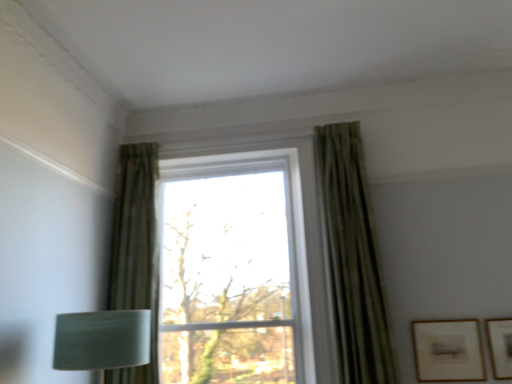
Image resolution: width=512 pixels, height=384 pixels. Identify the location of green textured curtain at upper right, which is the 1th curtain from right to left. (351, 258).

You are a GUI agent. You are given a task and a screenshot of the screen. Output one action in this format:
    pyautogui.click(x=<x>, y=<y>)
    Task: Click on the matte gold picture frame at lower right, arranged as the 1th picture frame when viewed from the right
    This screenshot has width=512, height=384.
    Given the screenshot: What is the action you would take?
    pyautogui.click(x=500, y=346)

Find the location of a particular element. This screenshot has width=512, height=384. green textured curtain at upper right, the 2th curtain from the left is located at coordinates (351, 258).

Is green textured curtain at upper right, the 2th curtain from the left, inside the boundaries of matte gold picture frame at lower right, the second picture frame viewed from the right, or outside?

green textured curtain at upper right, the 2th curtain from the left, is outside matte gold picture frame at lower right, the second picture frame viewed from the right.

Is green textured curtain at upper right, which is the 1th curtain from right to left, turned away from matte gold picture frame at lower right, the second picture frame viewed from the right?

No, green textured curtain at upper right, which is the 1th curtain from right to left, is not facing away from matte gold picture frame at lower right, the second picture frame viewed from the right.

Does green textured curtain at upper right, the 2th curtain from the left, have a greater height compared to matte gold picture frame at lower right, the first picture frame positioned from the left?

Yes.

From the image's perspective, count 2nd picture frames downward from the green textured curtain at upper right, the 2th curtain from the left, and point to it. Please provide its 2D coordinates.

[(448, 350)]

Image resolution: width=512 pixels, height=384 pixels. What are the coordinates of `window that appears on the left of matte gold picture frame at lower right, the second picture frame viewed from the right` in the screenshot? It's located at (234, 270).

Which is correct: transparent glass window at center is inside matte gold picture frame at lower right, the first picture frame positioned from the left, or outside of it?

A: transparent glass window at center is spatially situated outside matte gold picture frame at lower right, the first picture frame positioned from the left.

Between transparent glass window at center and matte gold picture frame at lower right, the second picture frame viewed from the right, which one has smaller width?

With smaller width is matte gold picture frame at lower right, the second picture frame viewed from the right.

Is transparent glass window at center not near matte gold picture frame at lower right, the second picture frame viewed from the right?

Yes, transparent glass window at center and matte gold picture frame at lower right, the second picture frame viewed from the right, are quite far apart.

Is green textured curtain at upper right, the 2th curtain from the left, oriented away from matte gold picture frame at lower right, positioned as the 2th picture frame in left-to-right order?

No, green textured curtain at upper right, the 2th curtain from the left,'s orientation is not away from matte gold picture frame at lower right, positioned as the 2th picture frame in left-to-right order.

Based on the photo, considering the sizes of objects green textured curtain at upper right, the 2th curtain from the left, and matte gold picture frame at lower right, positioned as the 2th picture frame in left-to-right order, in the image provided, who is shorter, green textured curtain at upper right, the 2th curtain from the left, or matte gold picture frame at lower right, positioned as the 2th picture frame in left-to-right order,?

matte gold picture frame at lower right, positioned as the 2th picture frame in left-to-right order.

From a real-world perspective, who is located lower, green textured curtain at upper right, the 2th curtain from the left, or matte gold picture frame at lower right, arranged as the 1th picture frame when viewed from the right?

matte gold picture frame at lower right, arranged as the 1th picture frame when viewed from the right, from a real-world perspective.

Is green textured curtain at left, acting as the second curtain starting from the right, wider or thinner than transparent glass window at center?

Considering their sizes, green textured curtain at left, acting as the second curtain starting from the right, looks slimmer than transparent glass window at center.

Which of these two, green textured curtain at left, marked as the 1th curtain in a left-to-right arrangement, or transparent glass window at center, is smaller?

green textured curtain at left, marked as the 1th curtain in a left-to-right arrangement, is smaller.

In the scene shown: Can you tell me how much green textured curtain at left, acting as the second curtain starting from the right, and transparent glass window at center differ in facing direction?

0.0179 degrees.

Is green textured curtain at left, marked as the 1th curtain in a left-to-right arrangement, completely or partially outside of transparent glass window at center?

green textured curtain at left, marked as the 1th curtain in a left-to-right arrangement, lies outside transparent glass window at center's area.

Which object is further away from the camera taking this photo, matte gold picture frame at lower right, the first picture frame positioned from the left, or matte gold picture frame at lower right, arranged as the 1th picture frame when viewed from the right?

matte gold picture frame at lower right, the first picture frame positioned from the left, is more distant.

Based on the photo, does matte gold picture frame at lower right, the first picture frame positioned from the left, have a lesser height compared to matte gold picture frame at lower right, positioned as the 2th picture frame in left-to-right order?

No, matte gold picture frame at lower right, the first picture frame positioned from the left, is not shorter than matte gold picture frame at lower right, positioned as the 2th picture frame in left-to-right order.

Which is behind, point (426, 334) or point (503, 376)?

The point (426, 334) is behind.

Is matte gold picture frame at lower right, the first picture frame positioned from the left, outside of matte gold picture frame at lower right, arranged as the 1th picture frame when viewed from the right?

Yes, matte gold picture frame at lower right, the first picture frame positioned from the left, is not within matte gold picture frame at lower right, arranged as the 1th picture frame when viewed from the right.

Is matte gold picture frame at lower right, arranged as the 1th picture frame when viewed from the right, oriented towards green textured curtain at left, marked as the 1th curtain in a left-to-right arrangement?

No, matte gold picture frame at lower right, arranged as the 1th picture frame when viewed from the right, is not facing towards green textured curtain at left, marked as the 1th curtain in a left-to-right arrangement.

Would you say matte gold picture frame at lower right, positioned as the 2th picture frame in left-to-right order, is to the left or to the right of green textured curtain at left, acting as the second curtain starting from the right, in the picture?

matte gold picture frame at lower right, positioned as the 2th picture frame in left-to-right order, is to the right of green textured curtain at left, acting as the second curtain starting from the right.

Considering the sizes of matte gold picture frame at lower right, arranged as the 1th picture frame when viewed from the right, and green textured curtain at left, marked as the 1th curtain in a left-to-right arrangement, in the image, is matte gold picture frame at lower right, arranged as the 1th picture frame when viewed from the right, wider or thinner than green textured curtain at left, marked as the 1th curtain in a left-to-right arrangement,?

In the image, matte gold picture frame at lower right, arranged as the 1th picture frame when viewed from the right, appears to be more narrow than green textured curtain at left, marked as the 1th curtain in a left-to-right arrangement.

Does point (501, 330) appear closer or farther from the camera than point (134, 371)?

Point (501, 330).

Between green textured curtain at left, acting as the second curtain starting from the right, and matte gold picture frame at lower right, positioned as the 2th picture frame in left-to-right order, which one is positioned behind?

green textured curtain at left, acting as the second curtain starting from the right, is further away from the camera.

Is green textured curtain at left, acting as the second curtain starting from the right, looking in the opposite direction of matte gold picture frame at lower right, positioned as the 2th picture frame in left-to-right order?

green textured curtain at left, acting as the second curtain starting from the right, is not turned away from matte gold picture frame at lower right, positioned as the 2th picture frame in left-to-right order.

This screenshot has height=384, width=512. In order to click on the 2nd curtain positioned above the matte gold picture frame at lower right, arranged as the 1th picture frame when viewed from the right (from a real-world perspective) in this screenshot , I will do `click(136, 251)`.

In the scene shown: How distant is green textured curtain at left, marked as the 1th curtain in a left-to-right arrangement, from matte gold picture frame at lower right, positioned as the 2th picture frame in left-to-right order?

green textured curtain at left, marked as the 1th curtain in a left-to-right arrangement, is 6.46 feet from matte gold picture frame at lower right, positioned as the 2th picture frame in left-to-right order.

Where is `the 1st picture frame located beneath the green textured curtain at upper right, which is the 1th curtain from right to left (from a real-world perspective)`? the 1st picture frame located beneath the green textured curtain at upper right, which is the 1th curtain from right to left (from a real-world perspective) is located at coordinates (448, 350).

Find the location of a particular element. Image resolution: width=512 pixels, height=384 pixels. window that is behind the matte gold picture frame at lower right, the second picture frame viewed from the right is located at coordinates (234, 270).

Which object lies further to the anchor point matte gold picture frame at lower right, arranged as the 1th picture frame when viewed from the right, matte gold picture frame at lower right, the first picture frame positioned from the left, or green textured curtain at upper right, which is the 1th curtain from right to left?

Based on the image, green textured curtain at upper right, which is the 1th curtain from right to left, appears to be further to matte gold picture frame at lower right, arranged as the 1th picture frame when viewed from the right.

Which object lies nearer to the anchor point matte gold picture frame at lower right, arranged as the 1th picture frame when viewed from the right, transparent glass window at center or matte gold picture frame at lower right, the first picture frame positioned from the left?

Among the two, matte gold picture frame at lower right, the first picture frame positioned from the left, is located nearer to matte gold picture frame at lower right, arranged as the 1th picture frame when viewed from the right.

When comparing their distances from green textured curtain at upper right, which is the 1th curtain from right to left, does green textured curtain at left, marked as the 1th curtain in a left-to-right arrangement, or matte gold picture frame at lower right, the first picture frame positioned from the left, seem closer?

matte gold picture frame at lower right, the first picture frame positioned from the left, lies closer to green textured curtain at upper right, which is the 1th curtain from right to left, than the other object.

From the image, which object appears to be farther from green textured curtain at upper right, the 2th curtain from the left, transparent glass window at center or matte gold picture frame at lower right, the first picture frame positioned from the left?

The object further to green textured curtain at upper right, the 2th curtain from the left, is transparent glass window at center.

Which object lies nearer to the anchor point green textured curtain at upper right, the 2th curtain from the left, matte gold picture frame at lower right, arranged as the 1th picture frame when viewed from the right, or matte gold picture frame at lower right, the second picture frame viewed from the right?

The object closer to green textured curtain at upper right, the 2th curtain from the left, is matte gold picture frame at lower right, the second picture frame viewed from the right.

Looking at the image, which one is located closer to green textured curtain at upper right, the 2th curtain from the left, transparent glass window at center or green textured curtain at left, marked as the 1th curtain in a left-to-right arrangement?

transparent glass window at center is positioned closer to the anchor green textured curtain at upper right, the 2th curtain from the left.

When comparing their distances from matte gold picture frame at lower right, the first picture frame positioned from the left, does green textured curtain at upper right, the 2th curtain from the left, or matte gold picture frame at lower right, arranged as the 1th picture frame when viewed from the right, seem closer?

The object closer to matte gold picture frame at lower right, the first picture frame positioned from the left, is matte gold picture frame at lower right, arranged as the 1th picture frame when viewed from the right.

When comparing their distances from green textured curtain at upper right, the 2th curtain from the left, does matte gold picture frame at lower right, arranged as the 1th picture frame when viewed from the right, or green textured curtain at left, acting as the second curtain starting from the right, seem further?

green textured curtain at left, acting as the second curtain starting from the right.

Locate an element on the screen. window located between green textured curtain at left, acting as the second curtain starting from the right, and matte gold picture frame at lower right, the first picture frame positioned from the left, in the left-right direction is located at coordinates (234, 270).

Where is `picture frame between green textured curtain at left, marked as the 1th curtain in a left-to-right arrangement, and matte gold picture frame at lower right, positioned as the 2th picture frame in left-to-right order, in the horizontal direction`? The width and height of the screenshot is (512, 384). picture frame between green textured curtain at left, marked as the 1th curtain in a left-to-right arrangement, and matte gold picture frame at lower right, positioned as the 2th picture frame in left-to-right order, in the horizontal direction is located at coordinates (448, 350).

Locate an element on the screen. window between green textured curtain at left, marked as the 1th curtain in a left-to-right arrangement, and matte gold picture frame at lower right, arranged as the 1th picture frame when viewed from the right is located at coordinates (234, 270).

The width and height of the screenshot is (512, 384). I want to click on picture frame between transparent glass window at center and matte gold picture frame at lower right, positioned as the 2th picture frame in left-to-right order, from left to right, so click(x=448, y=350).